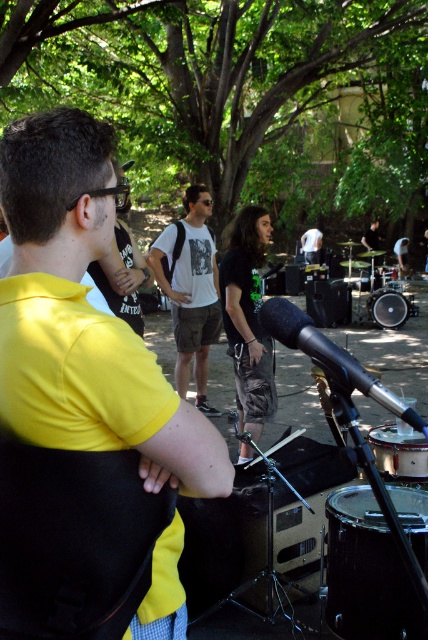
You are a stagehand setting up for a performance. You need to place a new black drum at center and ensure it doesn not block the green camouflage pants at center. Based on the scene description, which object should be placed closer to the audience to avoid blocking?

The black drum at center is smaller than green camouflage pants at center. To avoid blocking, the smaller black drum at center should be placed closer to the audience so it doesn t obstruct the view of the larger green camouflage pants at center.

From the picture: You are standing in the park where the band is performing. You notice two points marked in the scene. The first point is at coordinates point (338, 512) and the second is at point (199, 365). Which point is closer to your viewpoint?

Point (338, 512) is closer to the camera than point (199, 365), so the first point is closer to your viewpoint.